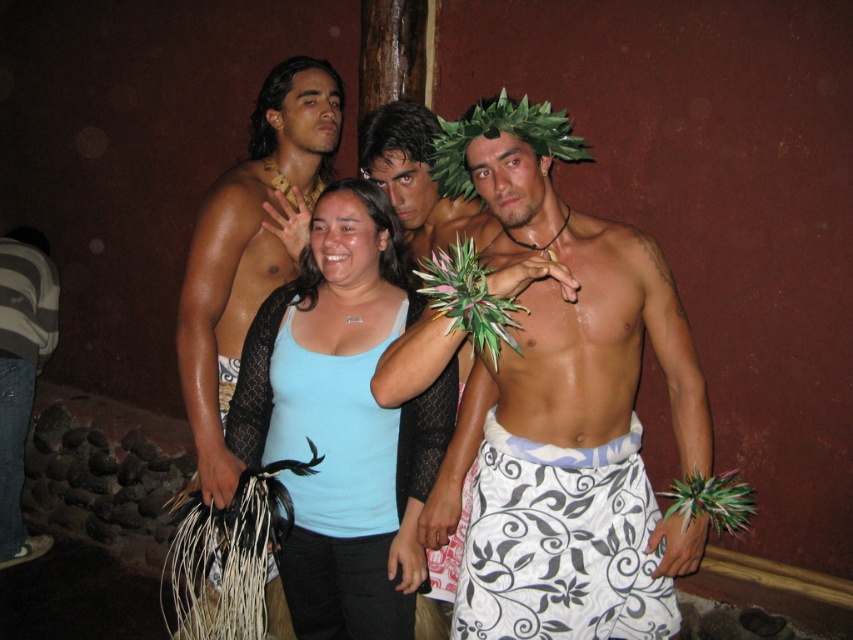
Question: Which point is closer to the camera taking this photo?

Choices:
 (A) (332, 504)
 (B) (0, 426)

Answer: (A)

Question: Does shiny gold necklace at left have a greater width compared to denim jeans at lower left?

Choices:
 (A) no
 (B) yes

Answer: (B)

Question: Which point appears farthest from the camera in this image?

Choices:
 (A) (335, 365)
 (B) (427, 176)
 (C) (590, 577)
 (D) (0, 563)

Answer: (D)

Question: Is white printed sarong at center wider than shiny gold necklace at left?

Choices:
 (A) yes
 (B) no

Answer: (A)

Question: Where is white printed sarong at center located in relation to light blue fabric shirt at center in the image?

Choices:
 (A) right
 (B) left

Answer: (A)

Question: Which point is farther from the camera taking this photo?

Choices:
 (A) (263, 253)
 (B) (521, 228)

Answer: (A)